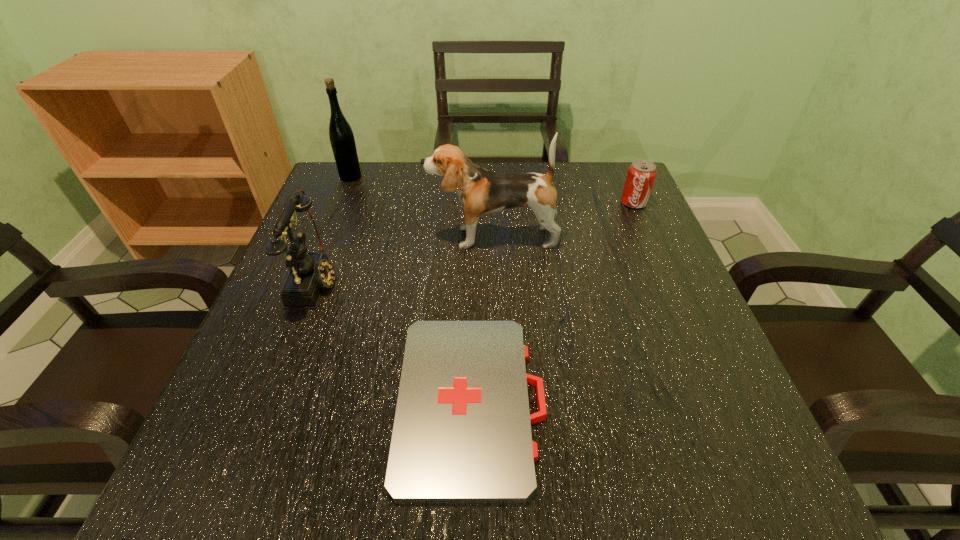
Identify the location of free space between the nearest object and the third shortest object. The image size is (960, 540). (394, 341).

Image resolution: width=960 pixels, height=540 pixels. In order to click on free area in between the puppy and the nearest object in this screenshot , I will do `click(482, 319)`.

The image size is (960, 540). I want to click on free space that is in between the puppy and the telephone, so click(404, 259).

Where is `vacant point located between the shortest object and the puppy`? Image resolution: width=960 pixels, height=540 pixels. vacant point located between the shortest object and the puppy is located at coordinates (482, 319).

Locate an element on the screen. free space between the puppy and the first-aid kit is located at coordinates (482, 319).

Where is `vacant area between the shortest object and the puppy`? vacant area between the shortest object and the puppy is located at coordinates (482, 319).

The width and height of the screenshot is (960, 540). I want to click on vacant region between the nearest object and the beer bottle, so click(x=411, y=289).

Locate which object ranks second in proximity to the nearest object. Please provide its 2D coordinates. Your answer should be formatted as a tuple, i.e. [(x, y)], where the tuple contains the x and y coordinates of a point satisfying the conditions above.

[(481, 192)]

At what (x,y) coordinates should I click in order to perform the action: click on the closest object to the farthest object. Please return your answer as a coordinate pair (x, y). The image size is (960, 540). Looking at the image, I should click on (310, 272).

Locate an element on the screen. This screenshot has width=960, height=540. vacant region that satisfies the following two spatial constraints: 1. on the front side of the soda can; 2. at the face of the puppy is located at coordinates (649, 237).